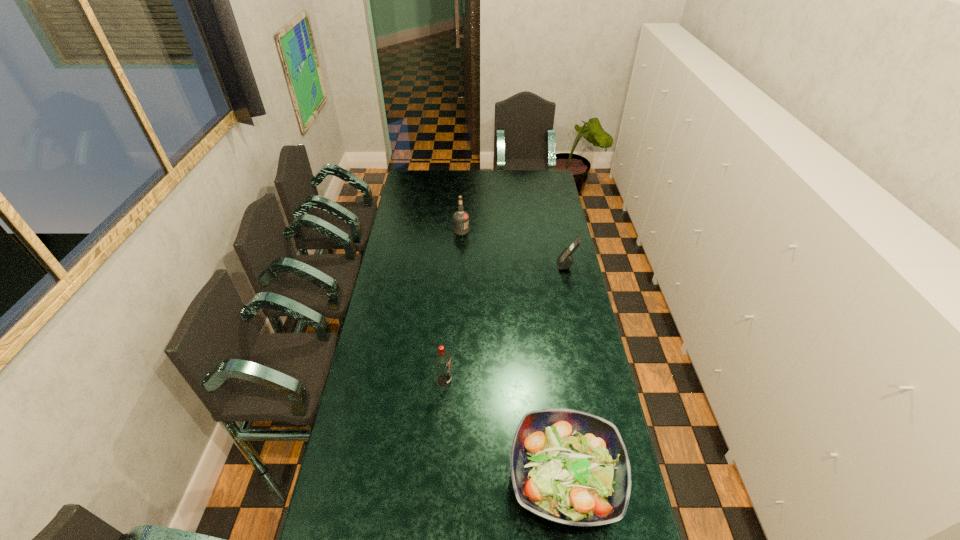
Locate an element on the screen. This screenshot has height=540, width=960. the farthest object is located at coordinates (461, 218).

In order to click on the nearer vodka in this screenshot , I will do `click(442, 360)`.

Locate an element on the screen. The image size is (960, 540). cellular telephone is located at coordinates (565, 260).

Locate an element on the screen. the third tallest object is located at coordinates (565, 260).

Locate an element on the screen. This screenshot has width=960, height=540. the shortest object is located at coordinates (571, 467).

This screenshot has width=960, height=540. I want to click on salad plate, so point(571,467).

At what (x,y) coordinates should I click in order to perform the action: click on vacant space located 0.210m on the front label of the farthest object. Please return your answer as a coordinate pair (x, y). This screenshot has width=960, height=540. Looking at the image, I should click on (509, 231).

The width and height of the screenshot is (960, 540). I want to click on vacant region located on the front label of the second nearest object, so click(508, 380).

Where is `vacant space located on the front-facing side of the cellular telephone`? The image size is (960, 540). vacant space located on the front-facing side of the cellular telephone is located at coordinates (481, 265).

The height and width of the screenshot is (540, 960). I want to click on vacant region located on the front-facing side of the cellular telephone, so click(x=479, y=265).